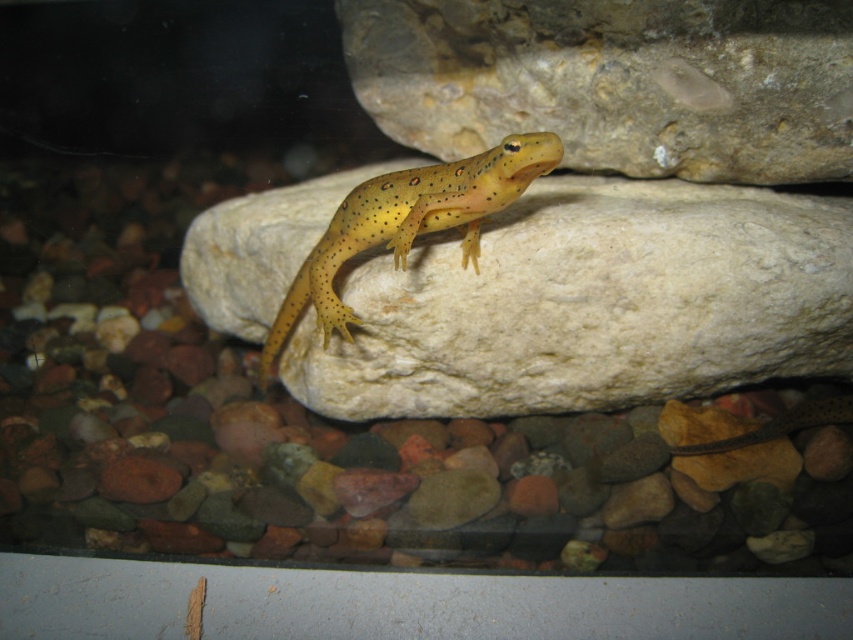
You are a small toy that is 3 inches long. You want to place yourself between the smooth rock at upper center and the yellow spotted lizard at center in the aquarium. Is there enough space for you to fit in that area?

The distance between the smooth rock at upper center and the yellow spotted lizard at center is 11.49 inches, so yes, the toy can fit in the space between them since it is longer than the toy.

You are a researcher observing the white smooth rock at center in a terrarium. You need to place a small sensor on it to monitor temperature. If your arm can reach 4 feet, can you place the sensor without moving the rock?

The white smooth rock at center is 4.30 feet away from the viewer. Since your arm can only reach 4 feet, you cannot reach the rock to place the sensor without moving it.

In the scene shown: You are a photographer taking a closeup of the yellow salamander with dark spots on the rock. You want to focus on the point that is closer to the camera. Which point should you choose between point (618, 188) and point (267, 336)?

Point (618, 188) is closer to the camera than point (267, 336), so you should focus on point (618, 188).